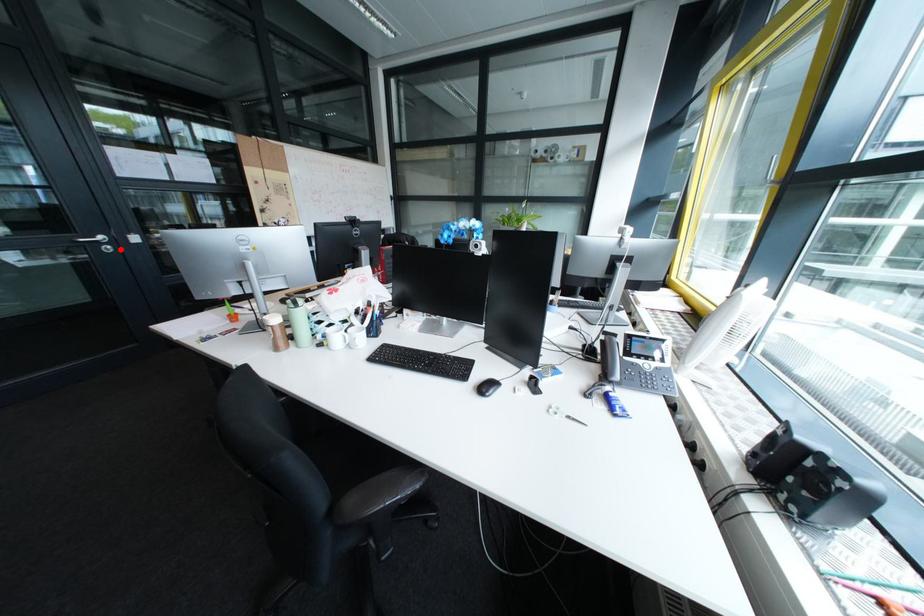
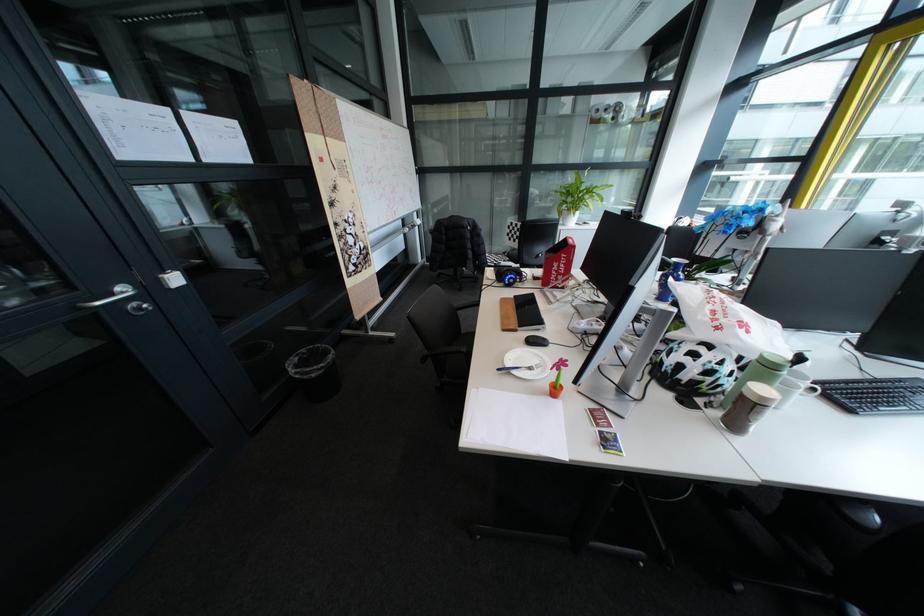
Find the pixel in the second image that matches the highlighted location in the first image.

(152, 309)